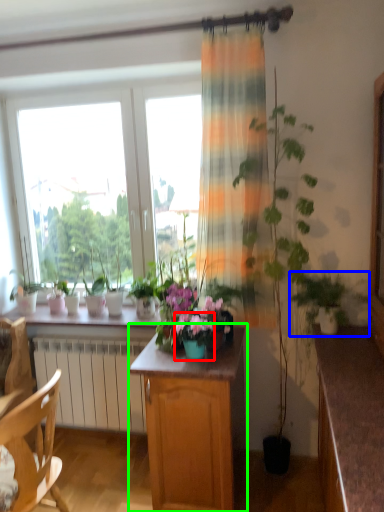
Question: Considering the real-world distances, which object is closest to flower box (highlighted by a red box)? houseplant (highlighted by a blue box) or cabinetry (highlighted by a green box).

Choices:
 (A) houseplant
 (B) cabinetry

Answer: (B)